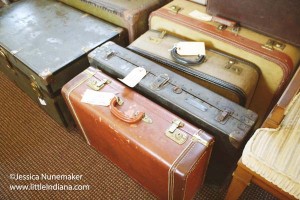
Where is `white cloth`? white cloth is located at coordinates (259, 161).